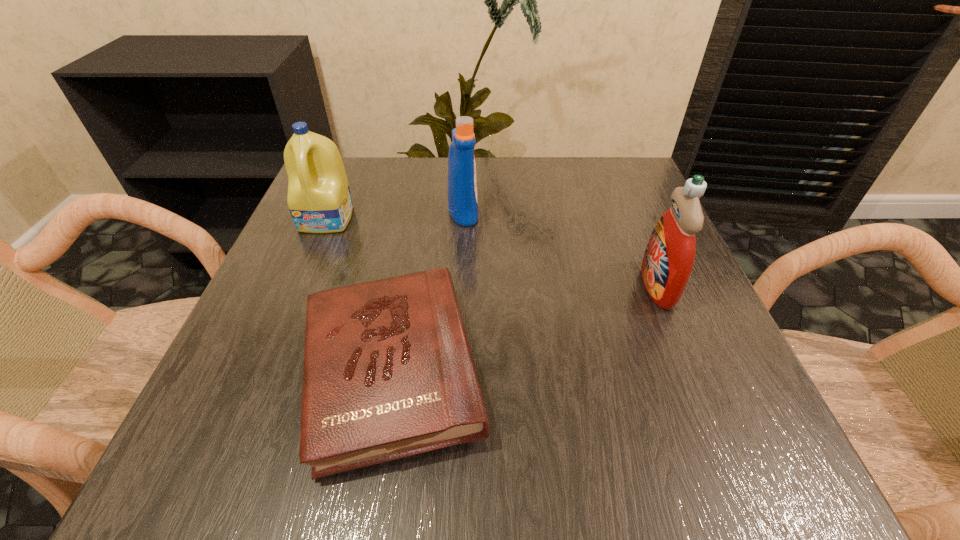
Image resolution: width=960 pixels, height=540 pixels. Identify the location of vacant space located on the back of the hardback book. (415, 235).

Identify the location of object located at the near edge. (388, 373).

Image resolution: width=960 pixels, height=540 pixels. I want to click on detergent at the left edge, so click(x=319, y=200).

Identify the location of hardback book present at the left edge. (388, 373).

In order to click on object at the right edge in this screenshot , I will do `click(668, 260)`.

Where is `object that is at the far left corner`? The width and height of the screenshot is (960, 540). object that is at the far left corner is located at coordinates (319, 200).

The height and width of the screenshot is (540, 960). I want to click on object that is at the near left corner, so click(x=388, y=373).

Image resolution: width=960 pixels, height=540 pixels. In order to click on blank area at the far edge in this screenshot , I will do `click(408, 181)`.

Find the location of a particular element. The image size is (960, 540). vacant space at the near edge is located at coordinates (605, 483).

The width and height of the screenshot is (960, 540). What are the coordinates of `vacant space at the left edge of the desktop` in the screenshot? It's located at (315, 261).